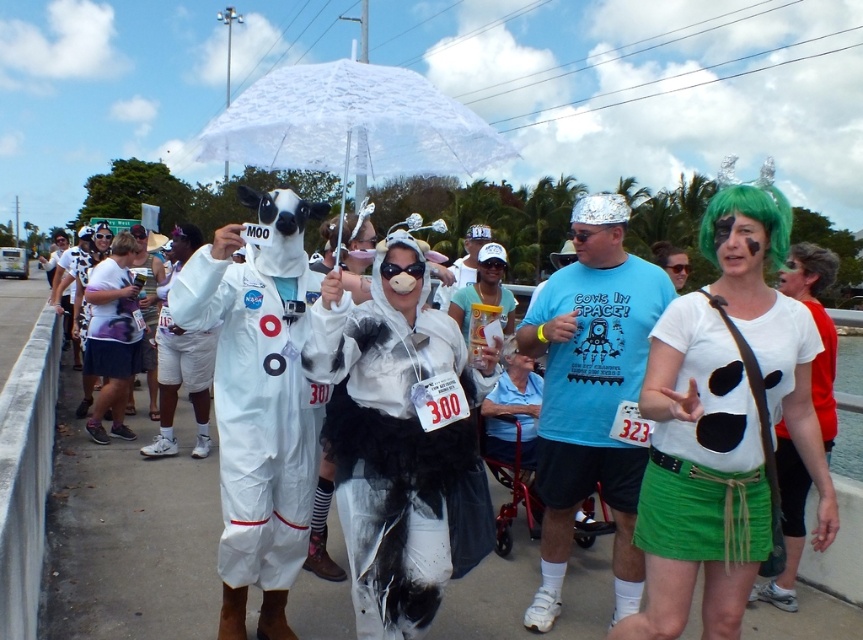
Between white lace umbrella at center and green synthetic wig at upper right, which one has more height?

Standing taller between the two is white lace umbrella at center.

Who is positioned more to the left, white lace umbrella at center or green synthetic wig at upper right?

white lace umbrella at center is more to the left.

Is point (406, 68) closer to viewer compared to point (786, 232)?

No, (406, 68) is behind (786, 232).

Image resolution: width=863 pixels, height=640 pixels. Find the location of `white lace umbrella at center`. white lace umbrella at center is located at coordinates (351, 124).

Does white fluffy costume at center have a smaller size compared to white lace umbrella at center?

Indeed, white fluffy costume at center has a smaller size compared to white lace umbrella at center.

Does white fluffy costume at center appear over white lace umbrella at center?

Incorrect, white fluffy costume at center is not positioned above white lace umbrella at center.

Find the location of a particular element. The height and width of the screenshot is (640, 863). white fluffy costume at center is located at coordinates (395, 438).

Where is `white fluffy costume at center`? white fluffy costume at center is located at coordinates (395, 438).

Is the position of white fabric astronaut suit at center more distant than that of green synthetic wig at upper right?

Yes, it is.

You are a GUI agent. You are given a task and a screenshot of the screen. Output one action in this format:
    pyautogui.click(x=<x>, y=<y>)
    Task: Click on the white fabric astronaut suit at center
    The height and width of the screenshot is (640, 863).
    Given the screenshot: What is the action you would take?
    pyautogui.click(x=257, y=412)

This screenshot has height=640, width=863. What are the coordinates of `white fabric astronaut suit at center` in the screenshot? It's located at (257, 412).